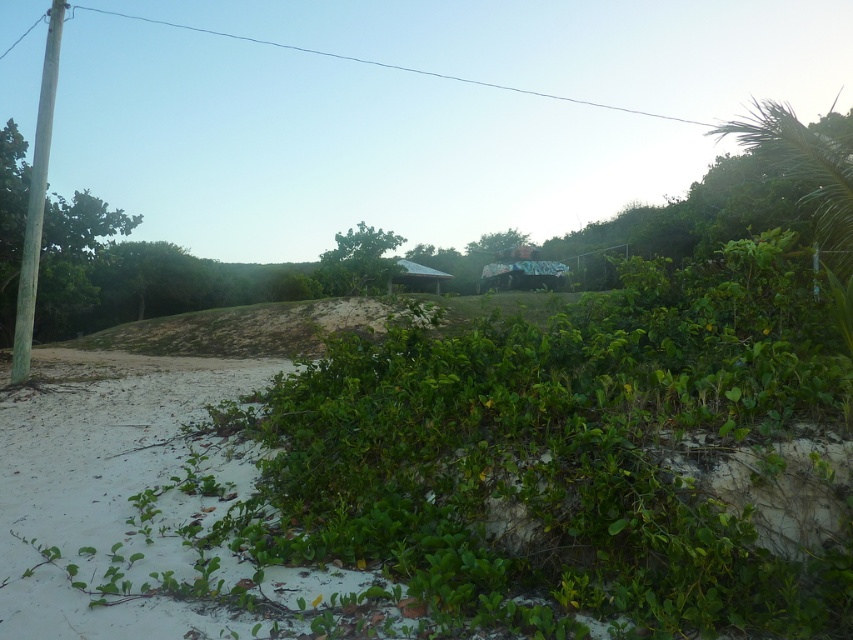
Can you confirm if smooth gray pole at left is thinner than green leafy bush at center?

Indeed, smooth gray pole at left has a lesser width compared to green leafy bush at center.

Which is above, smooth gray pole at left or green leafy bush at center?

green leafy bush at center

Which is behind, point (51, 35) or point (341, 248)?

Positioned behind is point (341, 248).

I want to click on smooth gray pole at left, so click(x=36, y=198).